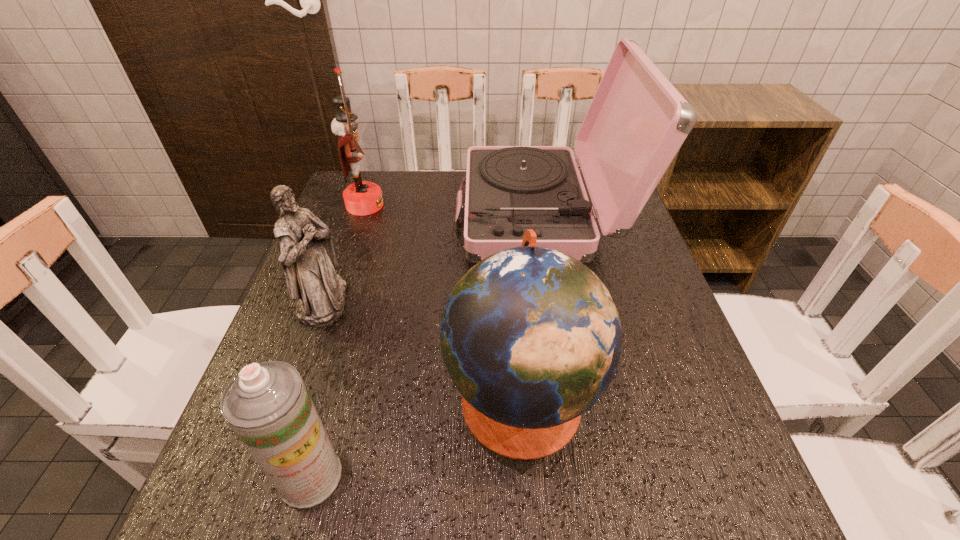
Identify which object is the second nearest to the figurine. Please provide its 2D coordinates. Your answer should be formatted as a tuple, i.e. [(x, y)], where the tuple contains the x and y coordinates of a point satisfying the conditions above.

[(531, 338)]

Identify which object is the fourth nearest to the globe. Please provide its 2D coordinates. Your answer should be formatted as a tuple, i.e. [(x, y)], where the tuple contains the x and y coordinates of a point satisfying the conditions above.

[(361, 198)]

This screenshot has width=960, height=540. What are the coordinates of `vacant space that satisfies the following two spatial constraints: 1. on the front-facing side of the nutcracker; 2. on the back side of the aerosol can` in the screenshot? It's located at (273, 476).

Where is `free location that satisfies the following two spatial constraints: 1. on the front-facing side of the third nearest object; 2. on the right side of the aerosol can`? The height and width of the screenshot is (540, 960). free location that satisfies the following two spatial constraints: 1. on the front-facing side of the third nearest object; 2. on the right side of the aerosol can is located at coordinates (261, 476).

At what (x,y) coordinates should I click in order to perform the action: click on vacant area that satisfies the following two spatial constraints: 1. on the front-facing side of the nutcracker; 2. on the back side of the aerosol can. Please return your answer as a coordinate pair (x, y). Looking at the image, I should click on (273, 476).

Find the location of a particular element. blank space that satisfies the following two spatial constraints: 1. on the front-facing side of the third farthest object; 2. on the right side of the aerosol can is located at coordinates (261, 476).